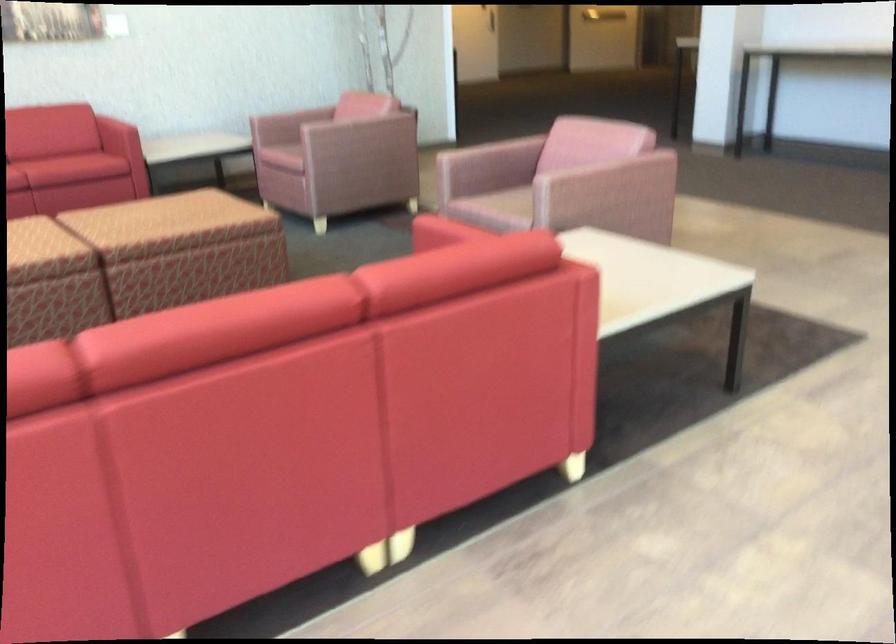
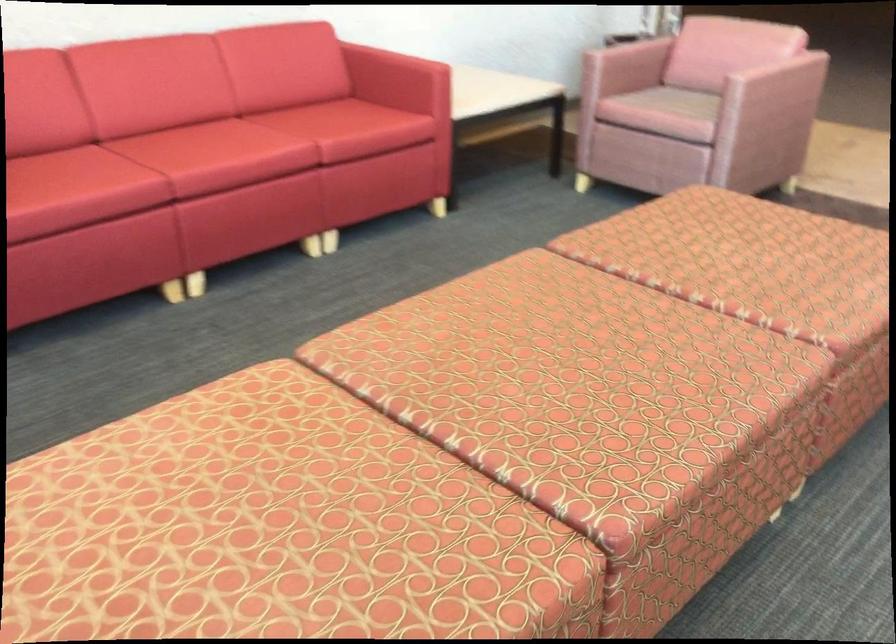
Find the pixel in the second image that matches (184,198) in the first image.

(762, 245)